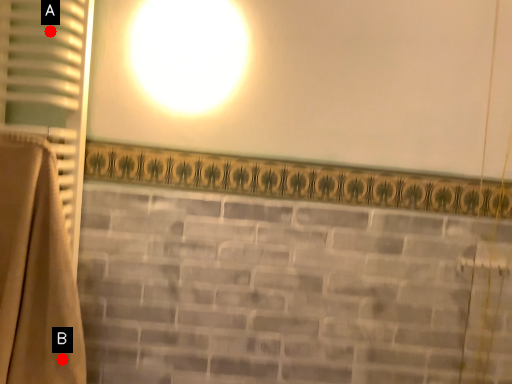
Question: Two points are circled on the image, labeled by A and B beside each circle. Among these points, which one is farthest from the camera?

Choices:
 (A) A is further
 (B) B is further

Answer: (A)